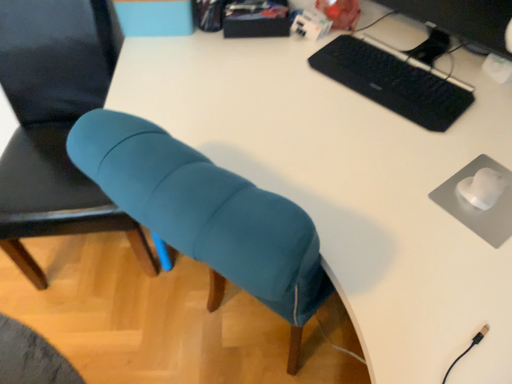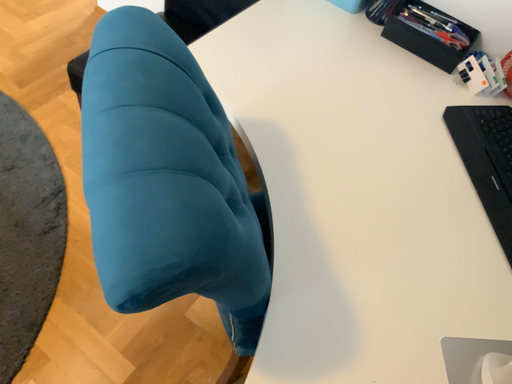
Question: How did the camera likely rotate when shooting the video?

Choices:
 (A) rotated left
 (B) rotated right

Answer: (A)